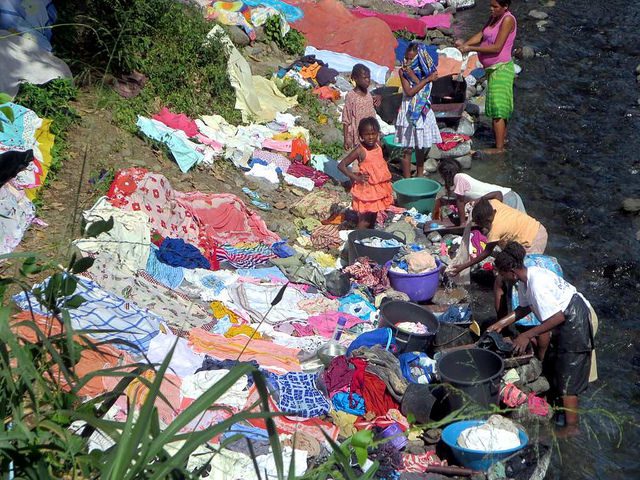
Where is `purple bin`? purple bin is located at coordinates (419, 281).